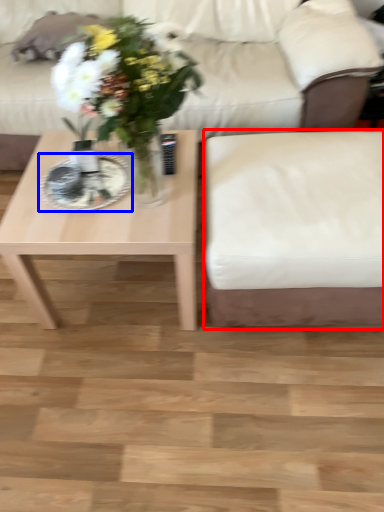
Question: Among these objects, which one is farthest to the camera, armchair (highlighted by a red box) or plate (highlighted by a blue box)?

Choices:
 (A) armchair
 (B) plate

Answer: (B)